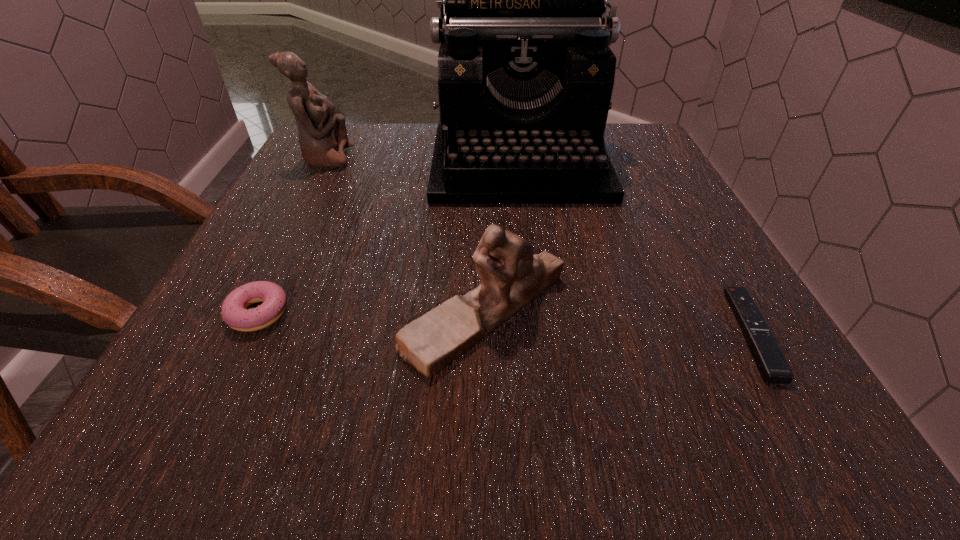
Locate an element on the screen. vacant space that is in between the fourth tallest object and the tallest object is located at coordinates (389, 238).

Where is `vacant point located between the typewriter and the shortest object`? vacant point located between the typewriter and the shortest object is located at coordinates (636, 248).

Locate an element on the screen. This screenshot has width=960, height=540. free space between the shortest object and the third shortest object is located at coordinates (618, 322).

Find the location of a particular element. free space that is in between the right figurine and the taller figurine is located at coordinates (404, 235).

The image size is (960, 540). What are the coordinates of `blank region between the right figurine and the fourth shortest object` in the screenshot? It's located at (404, 235).

Image resolution: width=960 pixels, height=540 pixels. What are the coordinates of `vacant area that lies between the typewriter and the second shortest object` in the screenshot? It's located at (389, 238).

The image size is (960, 540). In order to click on vacant area that lies between the taller figurine and the rightmost object in this screenshot , I will do `click(539, 245)`.

I want to click on free space that is in between the rightmost object and the right figurine, so click(x=618, y=322).

Find the location of a particular element. blank region between the tallest object and the second tallest object is located at coordinates (422, 160).

Locate an element on the screen. Image resolution: width=960 pixels, height=540 pixels. the second closest object to the left figurine is located at coordinates (511, 276).